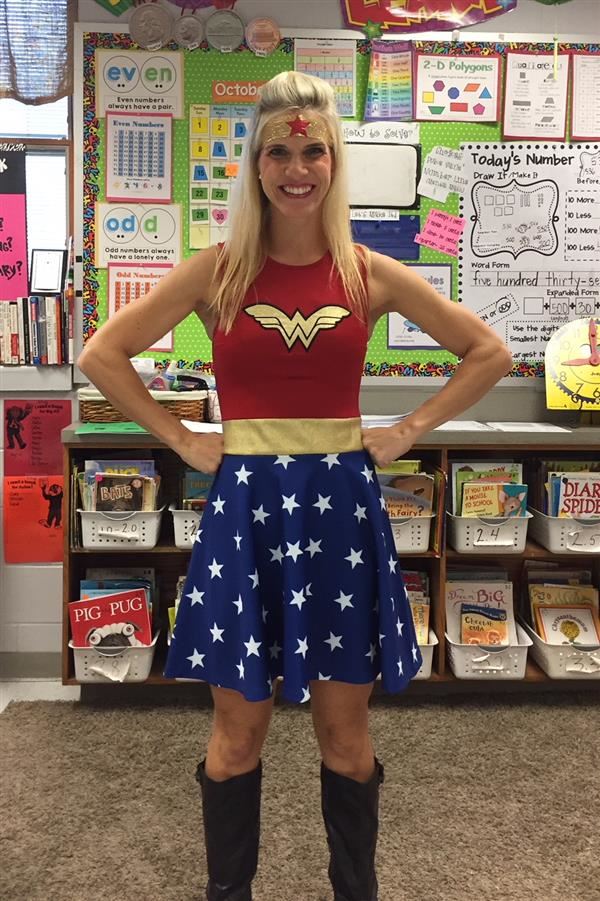
Locate an element on the screen. carpet is located at coordinates (491, 798).